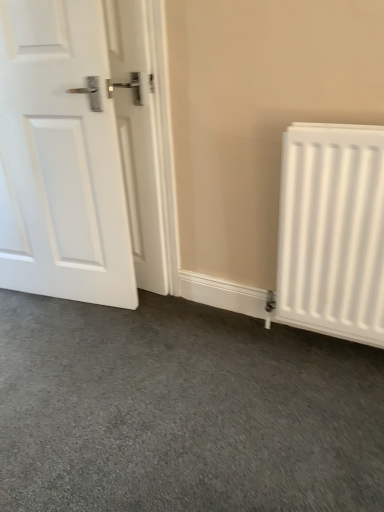
This screenshot has height=512, width=384. Identify the location of white matte door at left. (78, 153).

This screenshot has width=384, height=512. What do you see at coordinates (78, 153) in the screenshot?
I see `white matte door at left` at bounding box center [78, 153].

This screenshot has height=512, width=384. What are the coordinates of `white matte radiator at right` in the screenshot? It's located at (332, 231).

What do you see at coordinates (332, 231) in the screenshot? Image resolution: width=384 pixels, height=512 pixels. I see `white matte radiator at right` at bounding box center [332, 231].

This screenshot has width=384, height=512. Identify the location of white matte door at left. (78, 153).

Does white matte door at left appear on the left side of white matte radiator at right?

Yes.

Based on the photo, does white matte door at left come behind white matte radiator at right?

Yes, it is.

Is point (95, 59) positioned before point (348, 181)?

No, (95, 59) is behind (348, 181).

From the image's perspective, which one is positioned higher, white matte door at left or white matte radiator at right?

From the image's view, white matte door at left is above.

From a real-world perspective, which object stands above the other?

In real-world perspective, white matte door at left is above.

Is white matte door at left wider than white matte radiator at right?

Correct, the width of white matte door at left exceeds that of white matte radiator at right.

Does white matte door at left have a greater height compared to white matte radiator at right?

Yes, white matte door at left is taller than white matte radiator at right.

Is white matte door at left smaller than white matte radiator at right?

Incorrect, white matte door at left is not smaller in size than white matte radiator at right.

Is white matte door at left outside of white matte radiator at right?

Yes, white matte door at left is located beyond the bounds of white matte radiator at right.

Are white matte door at left and white matte radiator at right far apart?

That's not correct — white matte door at left is a little close to white matte radiator at right.

Is white matte door at left aimed at white matte radiator at right?

No, white matte door at left is not aimed at white matte radiator at right.

How different are the orientations of white matte door at left and white matte radiator at right in degrees?

The facing directions of white matte door at left and white matte radiator at right are 8.72 degrees apart.

Measure the distance from white matte door at left to white matte radiator at right.

A distance of 29.50 inches exists between white matte door at left and white matte radiator at right.

This screenshot has width=384, height=512. I want to click on door on the left side of white matte radiator at right, so click(x=78, y=153).

Considering the relative positions of white matte radiator at right and white matte door at left in the image provided, is white matte radiator at right to the left of white matte door at left from the viewer's perspective?

Incorrect, white matte radiator at right is not on the left side of white matte door at left.

Relative to white matte door at left, is white matte radiator at right in front or behind?

Clearly, white matte radiator at right is in front of white matte door at left.

Between point (280, 315) and point (125, 232), which one is positioned in front?

Positioned in front is point (280, 315).

From the image's perspective, is white matte radiator at right located above white matte door at left?

No, from the image's perspective, white matte radiator at right is not on top of white matte door at left.

From a real-world perspective, which is physically below, white matte radiator at right or white matte door at left?

white matte radiator at right, from a real-world perspective.

Considering the relative sizes of white matte radiator at right and white matte door at left in the image provided, is white matte radiator at right thinner than white matte door at left?

Yes, white matte radiator at right is thinner than white matte door at left.

In the scene shown: Which of these two, white matte radiator at right or white matte door at left, stands taller?

Standing taller between the two is white matte door at left.

Based on their sizes in the image, would you say white matte radiator at right is bigger or smaller than white matte door at left?

white matte radiator at right is smaller than white matte door at left.

Would you say white matte radiator at right is inside or outside white matte door at left?

The correct answer is: outside.

Can you see white matte radiator at right touching white matte door at left?

white matte radiator at right and white matte door at left are clearly separated.

Could you tell me if white matte radiator at right is facing white matte door at left?

No.

Can you tell me how much white matte radiator at right and white matte door at left differ in facing direction?

8.72 degrees separate the facing orientations of white matte radiator at right and white matte door at left.

Locate an element on the screen. radiator that is on the right side of white matte door at left is located at coordinates (332, 231).

In order to click on door to the left of white matte radiator at right in this screenshot , I will do `click(78, 153)`.

What are the coordinates of `radiator lying on the right of white matte door at left` in the screenshot? It's located at (332, 231).